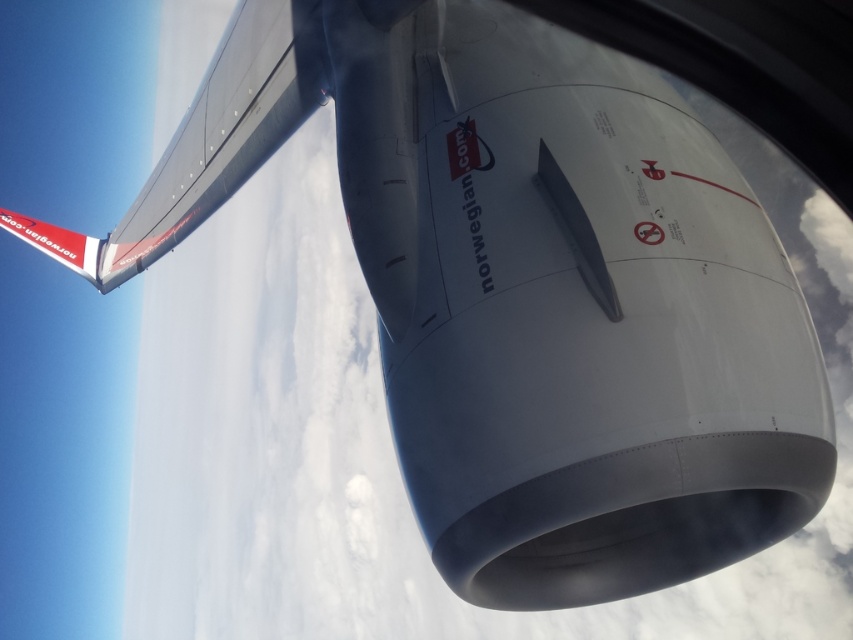
You are a maintenance technician inspecting an aircraft engine and wing. You notice a specific point on the wing at coordinates point (225, 129). Based on the scene description, what is the condition of the surface at that point?

The point (225, 129) marks the polished metallic wing at upper left, which is in good condition as described.

You are a flight attendant who needs to locate the emergency exit sign. You see the polished metallic wing at upper left and the white glossy tail at upper left. Which object is closer to the right side of the image?

The polished metallic wing at upper left is closer to the right side of the image because it is positioned to the right of the white glossy tail at upper left.